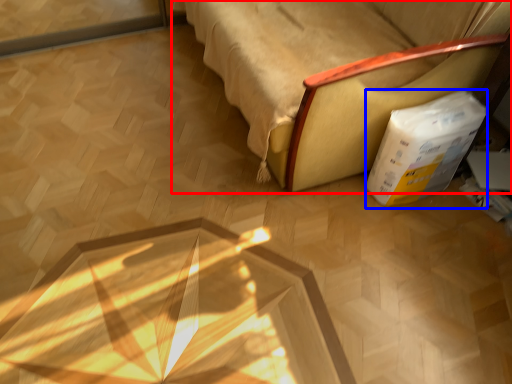
Question: Which object appears farthest to the camera in this image, furniture (highlighted by a red box) or cardboard box (highlighted by a blue box)?

Choices:
 (A) furniture
 (B) cardboard box

Answer: (B)